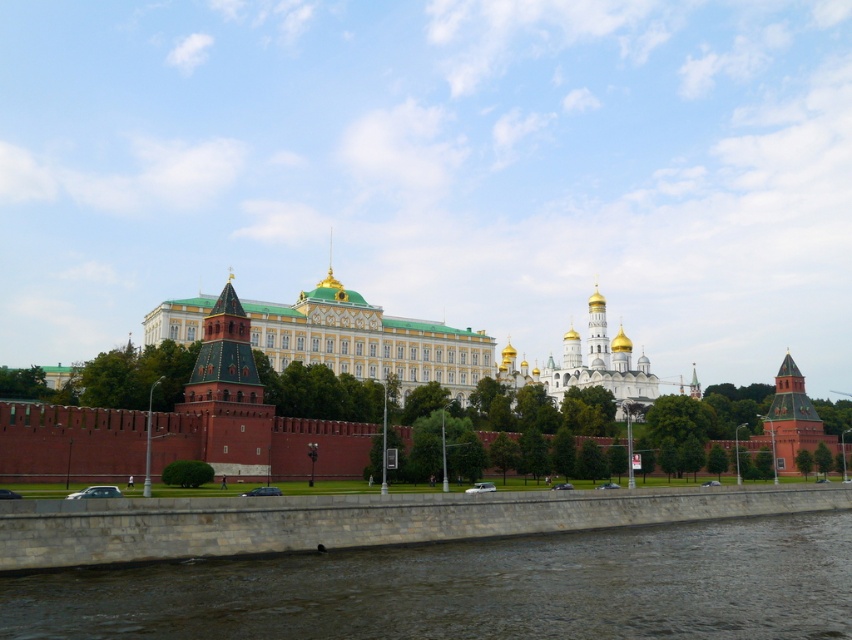
Question: Which of the following is the farthest from the observer?

Choices:
 (A) green tiled tower at center-left
 (B) brown stone river at lower center

Answer: (A)

Question: Which point appears closest to the camera in this image?

Choices:
 (A) (279, 532)
 (B) (171, 308)

Answer: (A)

Question: Considering the relative positions of white stone church at center and green tiled tower at center-left in the image provided, where is white stone church at center located with respect to green tiled tower at center-left?

Choices:
 (A) left
 (B) right

Answer: (B)

Question: Among these objects, which one is nearest to the camera?

Choices:
 (A) white stone church at center
 (B) stone embankment at lower center

Answer: (B)

Question: Can you confirm if brown stone river at lower center is positioned to the left of white stone church at center?

Choices:
 (A) no
 (B) yes

Answer: (B)

Question: Where is white stone church at center located in relation to green tiled tower at center-left in the image?

Choices:
 (A) right
 (B) left

Answer: (A)